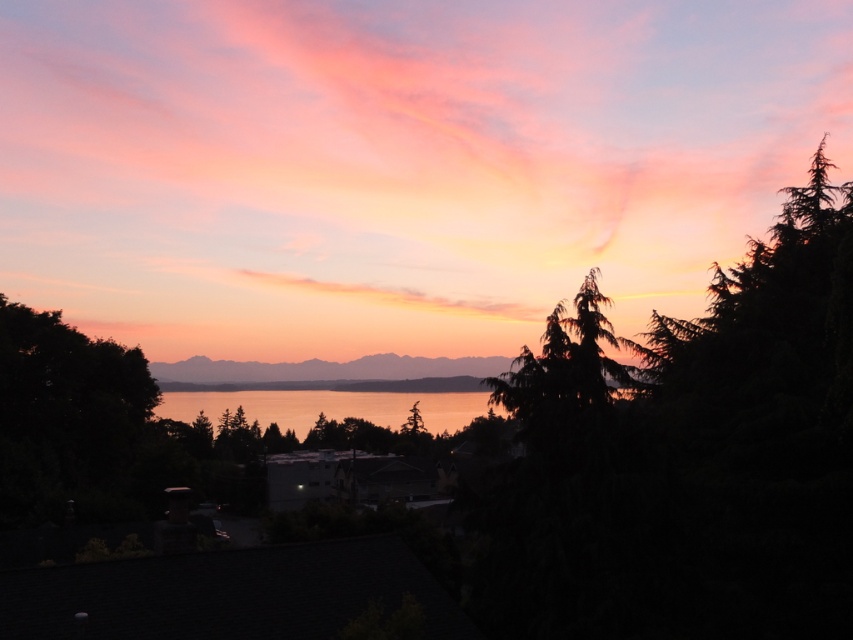
Who is positioned more to the left, green textured pine tree at center or golden reflective water at center?

Positioned to the left is golden reflective water at center.

Is point (596, 344) positioned in front of point (361, 406)?

That is True.

At what (x,y) coordinates should I click in order to perform the action: click on green textured pine tree at center. Please return your answer as a coordinate pair (x, y). The height and width of the screenshot is (640, 853). Looking at the image, I should click on (566, 380).